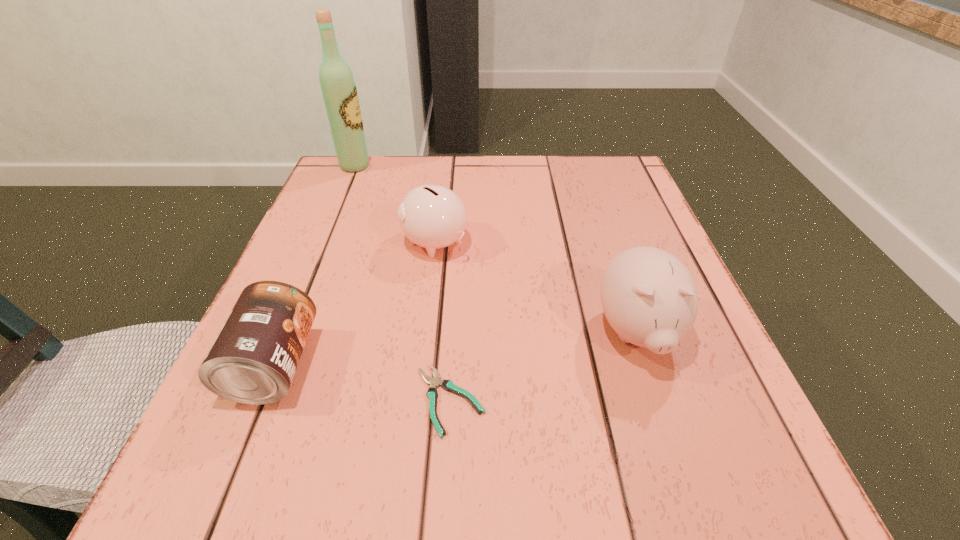
Identify the location of vacant space located on the right of the shorter piggy bank. The height and width of the screenshot is (540, 960). (600, 242).

You are a GUI agent. You are given a task and a screenshot of the screen. Output one action in this format:
    pyautogui.click(x=<x>, y=<y>)
    Task: Click on the vacant space positioned on the front label of the can
    
    Given the screenshot: What is the action you would take?
    pyautogui.click(x=570, y=364)

At what (x,y) coordinates should I click in order to perform the action: click on vacant space located on the right of the shortest object. Please return your answer as a coordinate pair (x, y). Looking at the image, I should click on (527, 400).

The image size is (960, 540). Find the location of `object that is at the far edge`. object that is at the far edge is located at coordinates (338, 87).

The image size is (960, 540). In order to click on wine bottle positioned at the left edge in this screenshot , I will do `click(338, 87)`.

This screenshot has height=540, width=960. I want to click on can located in the left edge section of the desktop, so click(253, 360).

Image resolution: width=960 pixels, height=540 pixels. I want to click on object present at the right edge, so click(649, 297).

At what (x,y) coordinates should I click in order to perform the action: click on object situated at the far left corner. Please return your answer as a coordinate pair (x, y). The height and width of the screenshot is (540, 960). Looking at the image, I should click on (338, 87).

Identify the location of vacant area at the far edge of the desktop. The height and width of the screenshot is (540, 960). (539, 199).

Find the location of a particular element. The height and width of the screenshot is (540, 960). free location at the near edge is located at coordinates (338, 511).